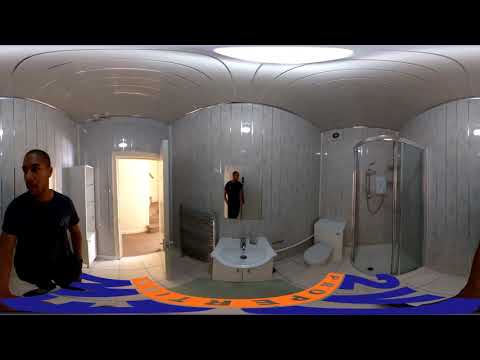
Find the location of `doorway`. doorway is located at coordinates (117, 216).